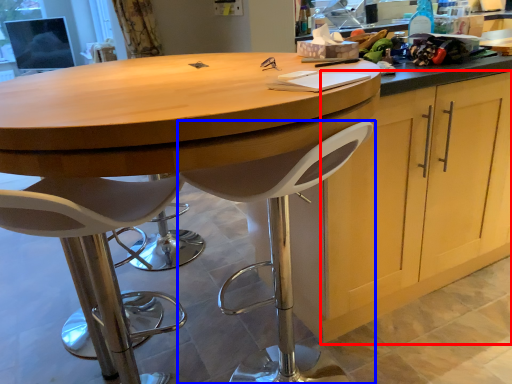
Question: Which of the following is the farthest to the observer, cabinetry (highlighted by a red box) or chair (highlighted by a blue box)?

Choices:
 (A) cabinetry
 (B) chair

Answer: (A)